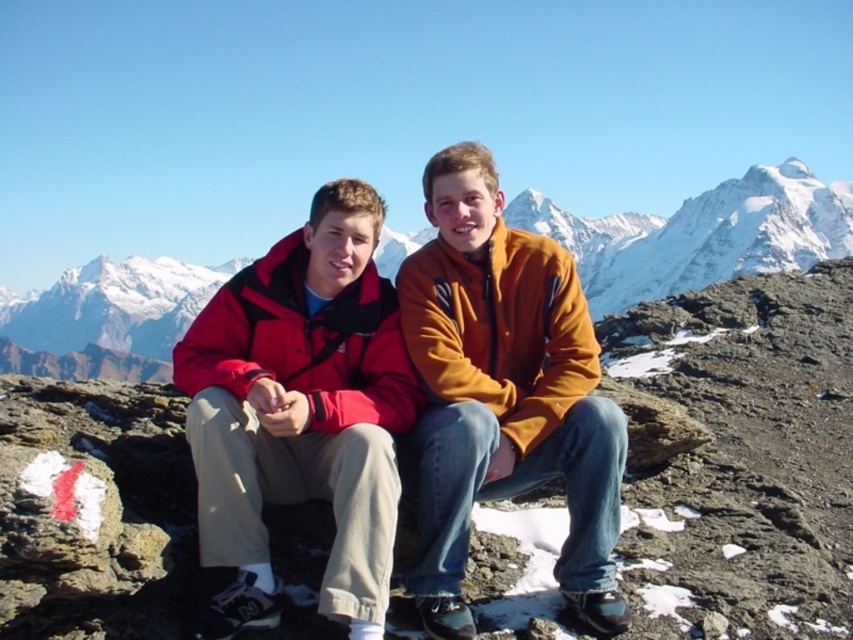
You are planning to take a photo of the snowy mountain at center and the orange fleece jacket at center from your current position. Which object should you frame first in your camera viewfinder to ensure both are in the shot?

The snowy mountain at center is to the left of orange fleece jacket at center, so you should frame the snowy mountain at center first on the left side of the viewfinder and then position the orange fleece jacket at center to its right to include both in the shot.

Based on the photo, you are planning a photography session and want to ensure that both the matte fleece jackets at center and the snowy mountain at center are visible in the frame. Given their sizes, which object should you focus on to ensure both are captured without cropping?

Since the matte fleece jackets at center occupies less space than the snowy mountain at center, you should focus on the snowy mountain at center to ensure both are captured without cropping, as it takes up more space and can help balance the composition.